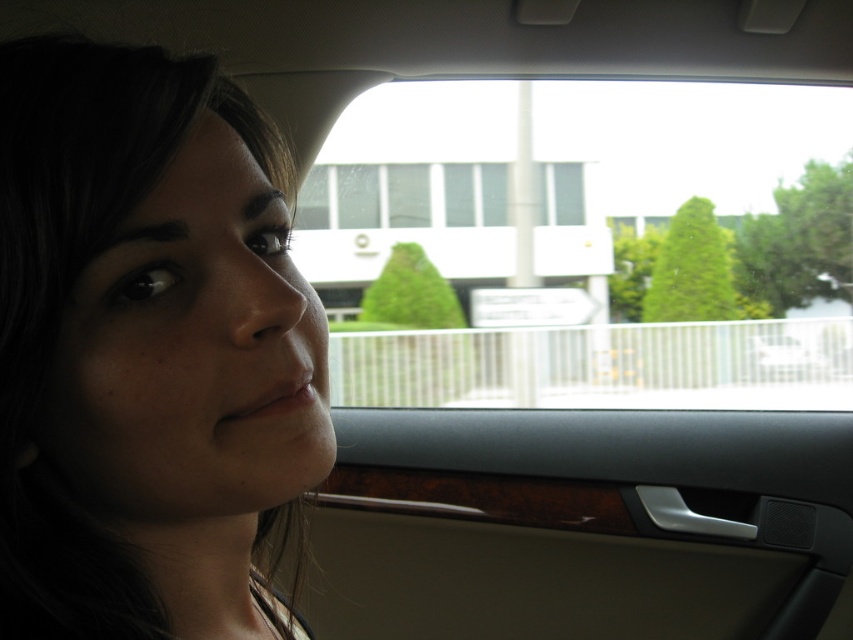
Question: Where is matte skin at center located in relation to transparent glass at upper center in the image?

Choices:
 (A) right
 (B) left

Answer: (B)

Question: Which object appears farthest from the camera in this image?

Choices:
 (A) transparent glass at upper center
 (B) matte skin at center

Answer: (A)

Question: Does matte skin at center appear on the right side of transparent glass at upper center?

Choices:
 (A) no
 (B) yes

Answer: (A)

Question: Among these points, which one is farthest from the camera?

Choices:
 (A) (381, 176)
 (B) (13, 333)

Answer: (A)

Question: Does matte skin at center have a larger size compared to transparent glass at upper center?

Choices:
 (A) yes
 (B) no

Answer: (B)